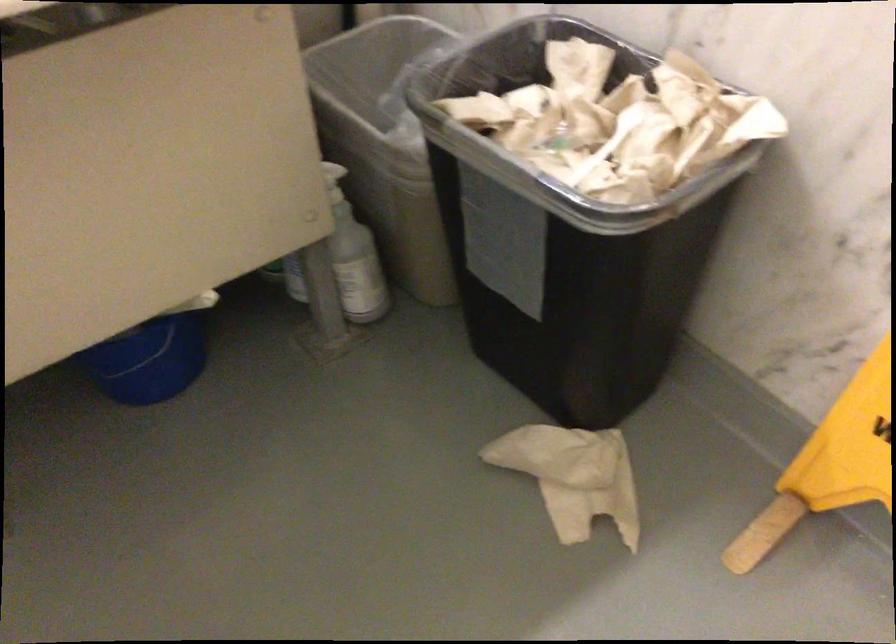
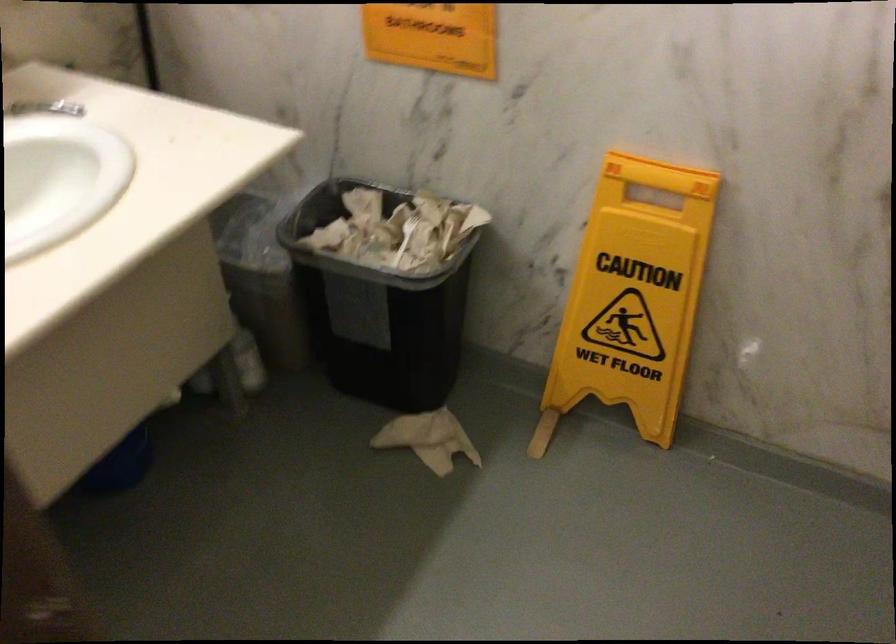
Question: The first image is from the beginning of the video and the second image is from the end. How did the camera likely rotate when shooting the video?

Choices:
 (A) Left
 (B) Right
 (C) Up
 (D) Down

Answer: (B)